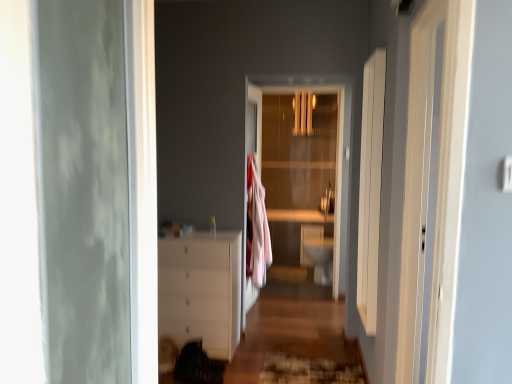
Locate an element on the screen. white glossy chest of drawers at center is located at coordinates coord(201,291).

You are a GUI agent. You are given a task and a screenshot of the screen. Output one action in this format:
    pyautogui.click(x=<x>, y=<y>)
    Task: Click on the white glossy toilet bowl at center
    Image resolution: width=512 pixels, height=384 pixels.
    Given the screenshot: What is the action you would take?
    pyautogui.click(x=320, y=259)

This screenshot has height=384, width=512. What do you see at coordinates (308, 371) in the screenshot? I see `textured brown rug at lower center` at bounding box center [308, 371].

Locate an element on the screen. The height and width of the screenshot is (384, 512). transparent glass door at center is located at coordinates (337, 130).

Is white glossy chest of drawers at center directly adjacent to transparent glass door at center?

There is a gap between white glossy chest of drawers at center and transparent glass door at center.

Based on the photo, what's the angular difference between white glossy chest of drawers at center and transparent glass door at center's facing directions?

white glossy chest of drawers at center and transparent glass door at center are facing 0.184 degrees away from each other.

Is white glossy chest of drawers at center positioned before transparent glass door at center?

Yes.

Is textured brown rug at lower center facing towards transparent glass door at center?

No, textured brown rug at lower center is not facing towards transparent glass door at center.

Considering the sizes of objects textured brown rug at lower center and transparent glass door at center in the image provided, who is smaller, textured brown rug at lower center or transparent glass door at center?

textured brown rug at lower center is smaller.

From the image's perspective, is textured brown rug at lower center under transparent glass door at center?

Indeed, from the image's perspective, textured brown rug at lower center is shown beneath transparent glass door at center.

In the image, is textured brown rug at lower center positioned in front of or behind transparent glass door at center?

textured brown rug at lower center is positioned closer to the viewer than transparent glass door at center.

You are a GUI agent. You are given a task and a screenshot of the screen. Output one action in this format:
    pyautogui.click(x=<x>, y=<y>)
    Task: Click on the toilet bowl on the right of the white glossy dresser at lower left
    Image resolution: width=512 pixels, height=384 pixels.
    Given the screenshot: What is the action you would take?
    pyautogui.click(x=320, y=259)

Considering the relative positions of white glossy toilet bowl at center and white glossy dresser at lower left in the image provided, is white glossy toilet bowl at center to the left of white glossy dresser at lower left from the viewer's perspective?

In fact, white glossy toilet bowl at center is to the right of white glossy dresser at lower left.

Which of these two, white glossy toilet bowl at center or white glossy dresser at lower left, stands taller?

Standing taller between the two is white glossy toilet bowl at center.

Who is more distant, white glossy toilet bowl at center or transparent glass door at center?

white glossy toilet bowl at center is more distant.

Is white glossy toilet bowl at center oriented away from transparent glass door at center?

No, white glossy toilet bowl at center is not facing away from transparent glass door at center.

Visually, is white glossy toilet bowl at center positioned to the left or to the right of transparent glass door at center?

Based on their positions, white glossy toilet bowl at center is located to the right of transparent glass door at center.

From a real-world perspective, between white glossy toilet bowl at center and transparent glass door at center, who is vertically higher?

transparent glass door at center is physically above.

From a real-world perspective, relative to textured brown rug at lower center, is white glossy chest of drawers at center vertically above or below?

white glossy chest of drawers at center is above textured brown rug at lower center.

Can you see white glossy chest of drawers at center touching textured brown rug at lower center?

No, white glossy chest of drawers at center is not in contact with textured brown rug at lower center.

Considering the relative sizes of white glossy chest of drawers at center and textured brown rug at lower center in the image provided, is white glossy chest of drawers at center thinner than textured brown rug at lower center?

Yes, white glossy chest of drawers at center is thinner than textured brown rug at lower center.

Which point is more forward, (233, 349) or (351, 367)?

The point (351, 367) is closer to the camera.

Based on the photo, are white glossy dresser at lower left and transparent glass door at center located far from each other?

No, white glossy dresser at lower left is in close proximity to transparent glass door at center.

Is white glossy dresser at lower left in front of or behind transparent glass door at center in the image?

Clearly, white glossy dresser at lower left is in front of transparent glass door at center.

Does white glossy dresser at lower left contain transparent glass door at center?

Actually, transparent glass door at center is outside white glossy dresser at lower left.

Is white glossy dresser at lower left taller than transparent glass door at center?

No.

Locate an element on the screen. This screenshot has width=512, height=384. path below the white glossy toilet bowl at center (from the image's perspective) is located at coordinates (291, 335).

From a real-world perspective, between white glossy dresser at lower left and white glossy toilet bowl at center, who is vertically lower?

white glossy dresser at lower left, from a real-world perspective.

Based on the photo, from the image's perspective, relative to white glossy toilet bowl at center, is white glossy dresser at lower left above or below?

From the image's perspective, white glossy dresser at lower left appears below white glossy toilet bowl at center.

You are a GUI agent. You are given a task and a screenshot of the screen. Output one action in this format:
    pyautogui.click(x=<x>, y=<y>)
    Task: Click on the door on the right of white glossy chest of drawers at center
    The width and height of the screenshot is (512, 384).
    Given the screenshot: What is the action you would take?
    pyautogui.click(x=337, y=130)

This screenshot has width=512, height=384. I want to click on door above the textured brown rug at lower center (from a real-world perspective), so click(337, 130).

Looking at this image, looking at the image, which one is located further to white glossy toilet bowl at center, white glossy dresser at lower left or white glossy chest of drawers at center?

white glossy chest of drawers at center is positioned further to the anchor white glossy toilet bowl at center.

Based on their spatial positions, is textured brown rug at lower center or white glossy chest of drawers at center closer to white glossy dresser at lower left?

The object closer to white glossy dresser at lower left is textured brown rug at lower center.

From the image, which object appears to be nearer to white glossy dresser at lower left, white glossy toilet bowl at center or white glossy chest of drawers at center?

white glossy chest of drawers at center.

Estimate the real-world distances between objects in this image. Which object is closer to white glossy toilet bowl at center, white glossy dresser at lower left or transparent glass door at center?

white glossy dresser at lower left is closer to white glossy toilet bowl at center.

Looking at this image, estimate the real-world distances between objects in this image. Which object is further from textured brown rug at lower center, white glossy toilet bowl at center or white glossy dresser at lower left?

white glossy toilet bowl at center is further to textured brown rug at lower center.

When comparing their distances from white glossy dresser at lower left, does transparent glass door at center or textured brown rug at lower center seem further?

transparent glass door at center is positioned further to the anchor white glossy dresser at lower left.

From the image, which object appears to be nearer to transparent glass door at center, white glossy dresser at lower left or textured brown rug at lower center?

white glossy dresser at lower left is positioned closer to the anchor transparent glass door at center.

From the image, which object appears to be farther from white glossy chest of drawers at center, white glossy dresser at lower left or textured brown rug at lower center?

Among the two, textured brown rug at lower center is located further to white glossy chest of drawers at center.

Identify the location of door located between textured brown rug at lower center and white glossy toilet bowl at center in the depth direction. This screenshot has width=512, height=384. (337, 130).

The height and width of the screenshot is (384, 512). In order to click on doormat between white glossy dresser at lower left and transparent glass door at center from front to back in this screenshot , I will do `click(308, 371)`.

The height and width of the screenshot is (384, 512). I want to click on path located between white glossy chest of drawers at center and textured brown rug at lower center in the left-right direction, so click(291, 335).

Image resolution: width=512 pixels, height=384 pixels. What are the coordinates of `the chest of drawers positioned between textured brown rug at lower center and transparent glass door at center from near to far` in the screenshot? It's located at (201, 291).